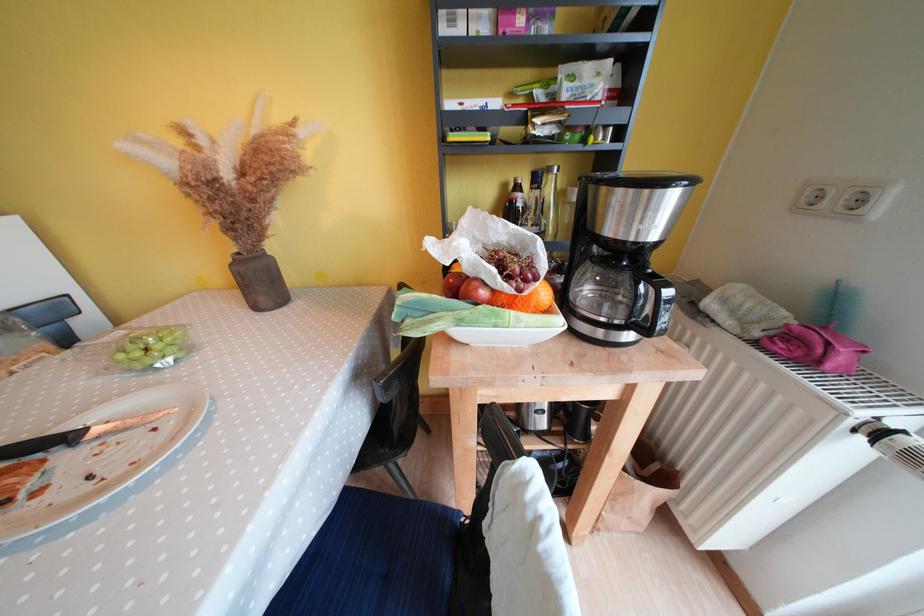
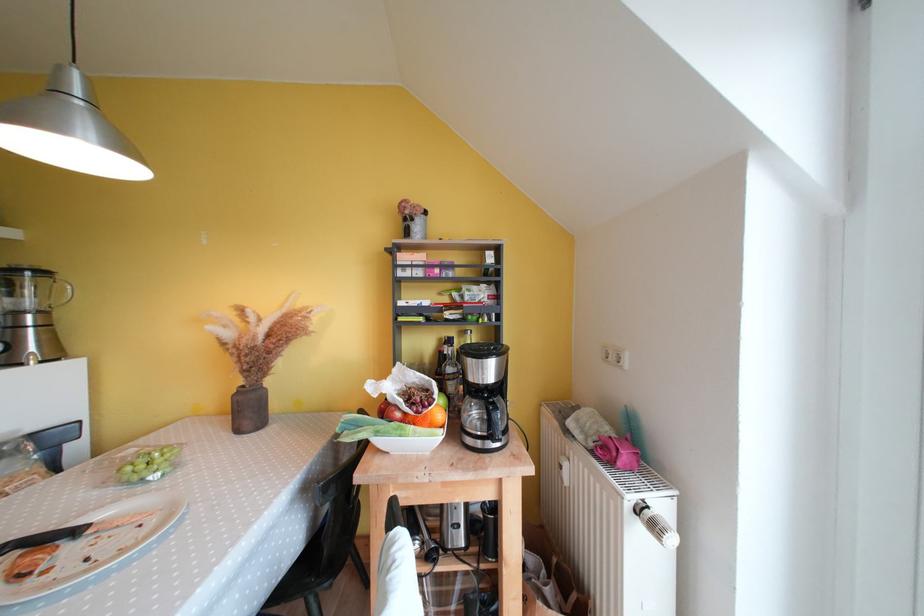
Locate, in the second image, the point that corresponds to pixel 544 191 in the first image.

(457, 350)